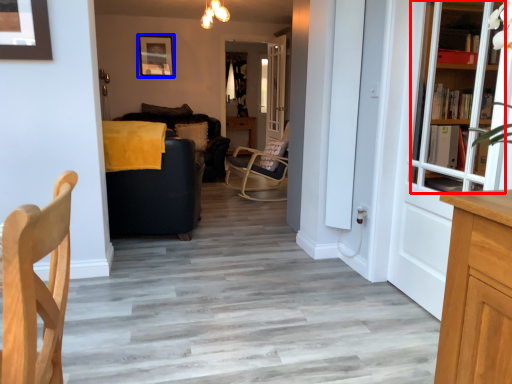
Question: Among these objects, which one is farthest to the camera, bookcase (highlighted by a red box) or picture frame (highlighted by a blue box)?

Choices:
 (A) bookcase
 (B) picture frame

Answer: (B)